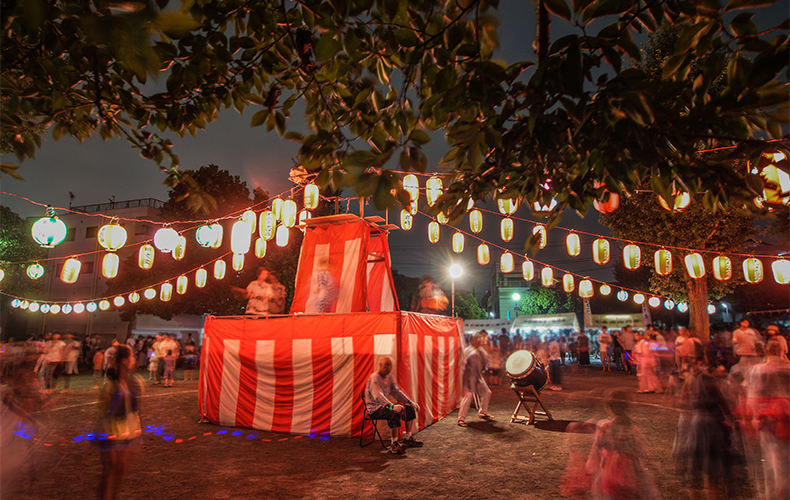
This screenshot has height=500, width=790. I want to click on string of hanging lights, so click(141, 221), click(134, 244), click(190, 275), click(716, 151), click(641, 192), click(615, 239), click(536, 262).